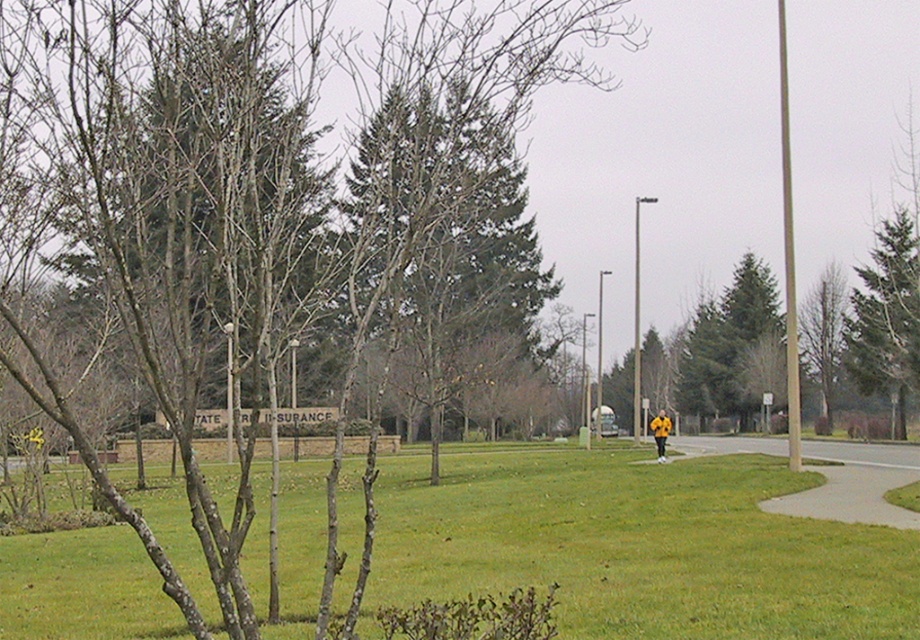
You are standing at the point marked by the coordinates point (242, 205) in the image. Looking around, you see a smooth bark tree at center. What is the nearest object to you?

The nearest object to you is the smooth bark tree at center, as you are standing exactly at the coordinates point (242, 205) which marks its location.

Consider the image. You are planning to set up a small tent in the green grass at center for a picnic. Considering the presence of the green textured tree at upper right, how does the height of the grass compare to the tree?

The green grass at center has a lesser height compared to the green textured tree at upper right, so the grass is shorter than the tree.